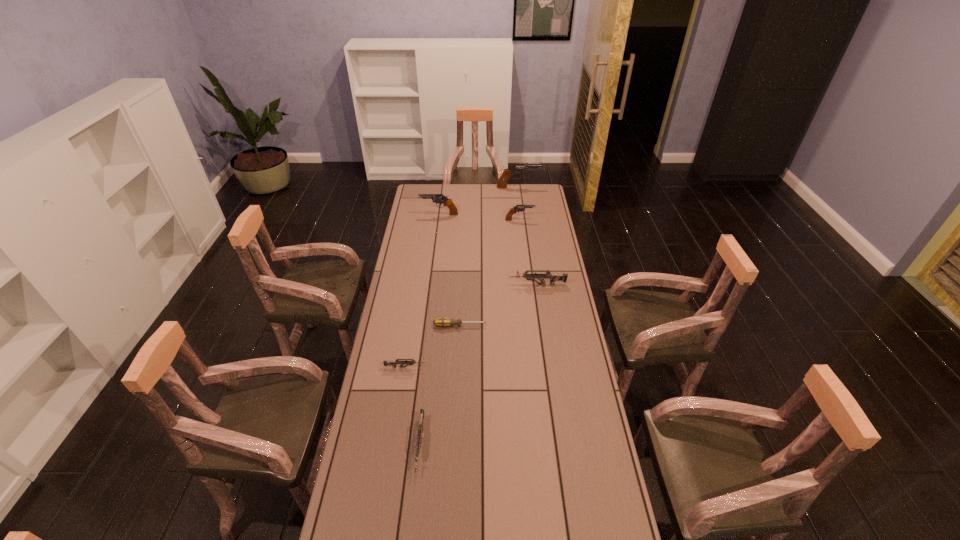
Identify the location of empty space between the nearest grey gun and the fourth nearest object. The image size is (960, 540). (479, 365).

The image size is (960, 540). I want to click on unoccupied area between the farthest gun and the second shortest object, so click(x=462, y=277).

Where is `vacant space in between the farthest object and the nearest gun`? The image size is (960, 540). vacant space in between the farthest object and the nearest gun is located at coordinates (469, 316).

The width and height of the screenshot is (960, 540). Identify the location of object that ranks as the fifth closest to the farthest gun. (393, 363).

Locate an element on the screen. object that is the third nearest to the fourth shortest object is located at coordinates (393, 363).

Identify the location of gun that can be found as the fifth closest to the smallest black gun. This screenshot has height=540, width=960. (420, 427).

At what (x,y) coordinates should I click in order to perform the action: click on gun that is the fourth closest one to the nearest black gun. Please return your answer as a coordinate pair (x, y). Image resolution: width=960 pixels, height=540 pixels. Looking at the image, I should click on (393, 363).

Locate which black gun is the closest to the sixth nearest object. Please provide its 2D coordinates. Your answer should be formatted as a tuple, i.e. [(x, y)], where the tuple contains the x and y coordinates of a point satisfying the conditions above.

[(518, 208)]

You are a GUI agent. You are given a task and a screenshot of the screen. Output one action in this format:
    pyautogui.click(x=<x>, y=<y>)
    Task: Click on the black gun object that ranks as the closest to the nearest black gun
    
    Given the screenshot: What is the action you would take?
    pyautogui.click(x=439, y=198)

Point out which grey gun is positioned as the second nearest to the nearest black gun. Please provide its 2D coordinates. Your answer should be formatted as a tuple, i.e. [(x, y)], where the tuple contains the x and y coordinates of a point satisfying the conditions above.

[(393, 363)]